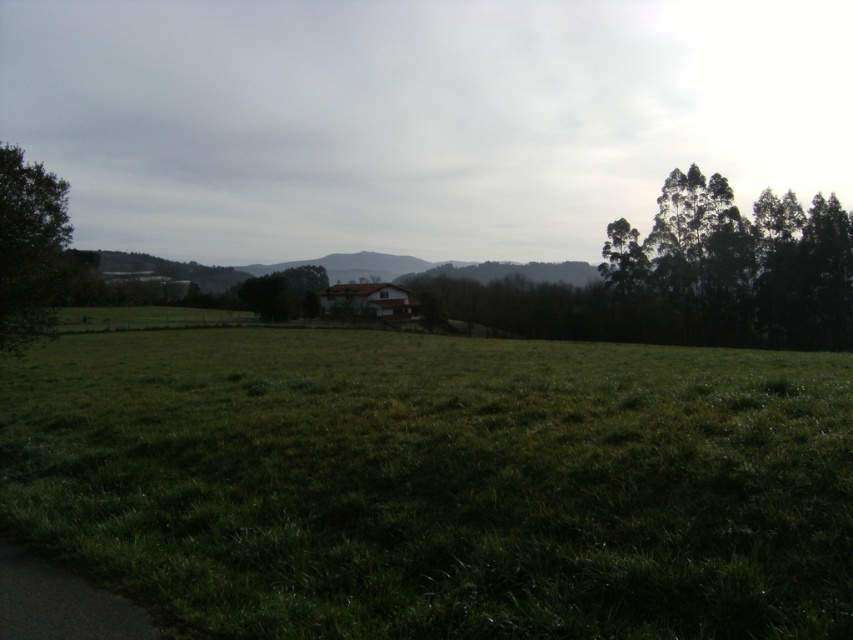
You are standing at the bottom left corner of the image where the paved path starts. You want to walk directly towards the green leafy trees at right. Which direction should you head?

The green leafy trees at right are located at point 0.414 on the x axis and 0.868 on the y axis. Since you are at the bottom left corner, you should head towards the right and slightly upwards to reach them.

Based on the photo, you are a bird looking for a nesting spot. You see the green leafy trees at right and the green leafy tree at center. Which tree is taller and would be better for your nest?

The green leafy trees at right is taller than the green leafy tree at center, so it would be better for your nest.